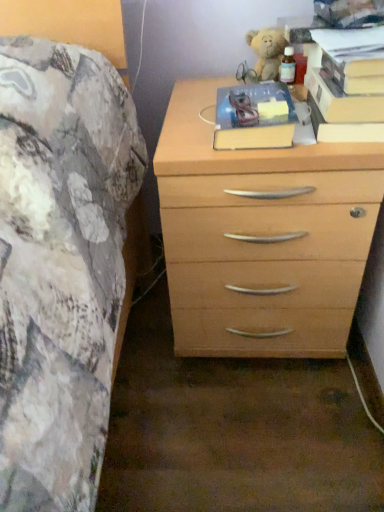
This screenshot has width=384, height=512. Identify the location of free space to the left of hardcover book at center, the 3th paperback book viewed from the right. (186, 134).